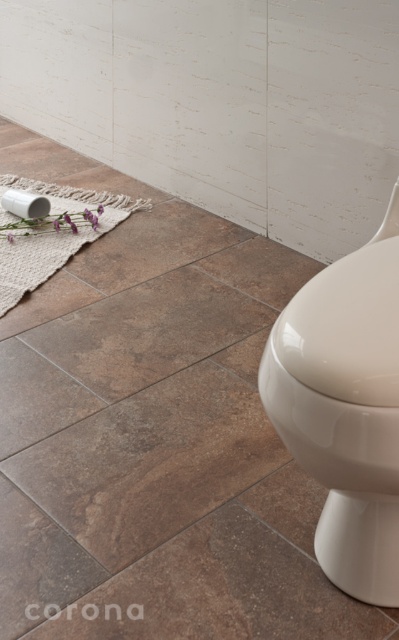
Question: Does purple matte flower at lower left have a smaller size compared to white matte toilet paper at lower left?

Choices:
 (A) no
 (B) yes

Answer: (A)

Question: Is glossy ceramic toilet bowl at lower right wider than white matte toilet paper at lower left?

Choices:
 (A) yes
 (B) no

Answer: (A)

Question: Does white woven mat at lower left appear on the left side of brown tile at lower left?

Choices:
 (A) yes
 (B) no

Answer: (A)

Question: Which object is the farthest from the brown tile at lower left?

Choices:
 (A) white matte toilet paper at lower left
 (B) brown tile at center

Answer: (A)

Question: Which point appears closest to the camera in this image?

Choices:
 (A) (23, 387)
 (B) (31, 184)
 (C) (17, 205)

Answer: (A)

Question: Which point is closer to the camera taking this photo?

Choices:
 (A) (41, 401)
 (B) (288, 326)
 (C) (73, 253)

Answer: (B)